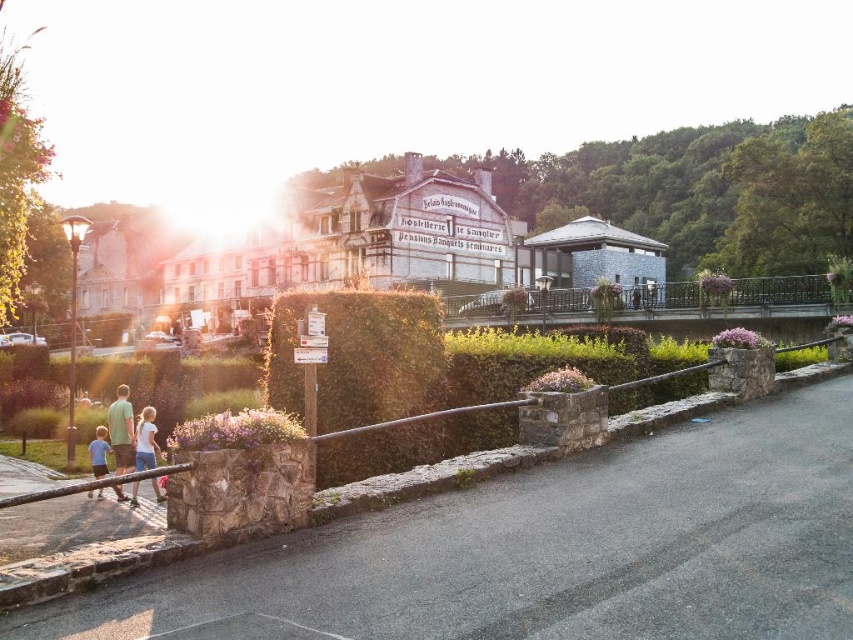
Does gray stone building at center have a smaller size compared to blue cotton shirt at lower left?

No, gray stone building at center is not smaller than blue cotton shirt at lower left.

Can you confirm if gray stone building at center is bigger than blue cotton shirt at lower left?

Indeed, gray stone building at center has a larger size compared to blue cotton shirt at lower left.

Is point (590, 275) in front of point (102, 461)?

No, (590, 275) is further to viewer.

Locate an element on the screen. gray stone building at center is located at coordinates (596, 257).

Who is lower down, white wooden hotel at center or blue cotton shirt at lower left?

Positioned lower is blue cotton shirt at lower left.

Does white wooden hotel at center have a smaller size compared to blue cotton shirt at lower left?

Incorrect, white wooden hotel at center is not smaller in size than blue cotton shirt at lower left.

Between point (271, 256) and point (94, 432), which one is positioned in front?

Point (94, 432)

What are the coordinates of `white wooden hotel at center` in the screenshot? It's located at (357, 243).

Between green leafy hedge at center and blue cotton shirt at lower left, which one has less height?

With less height is blue cotton shirt at lower left.

Which is in front, point (444, 396) or point (97, 467)?

Point (444, 396)

The height and width of the screenshot is (640, 853). I want to click on green leafy hedge at center, so click(358, 355).